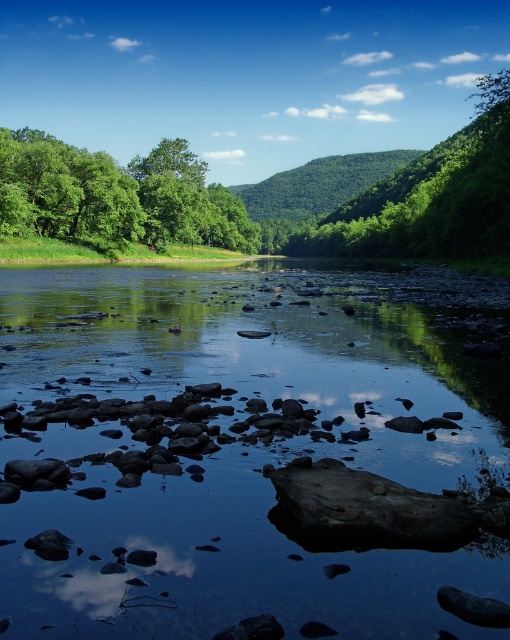
You are planning to cross the river using the smooth rock stream at center. However, you need to know if the stream is taller than the green leafy tree at upper center to ensure safety. Can you confirm this?

The smooth rock stream at center is not as tall as the green leafy tree at upper center, so it is shorter. Therefore, the stream is not taller than the tree, and you should proceed with caution when crossing.

You are planning to cross the river using the smooth rock stream at center and the green leafy tree at upper left. Which one is smaller in size?

The smooth rock stream at center has a smaller size compared to the green leafy tree at upper left.

You are a hiker standing at the riverbank and want to take a photo of both the green leafy tree at upper left and the green leafy tree at upper center. Which tree should you stand closer to in order to capture both in a single frame?

You should stand closer to the green leafy tree at upper left because it is shorter than the green leafy tree at upper center. By positioning yourself nearer to the shorter tree, you can adjust your camera angle to include both trees within the frame.